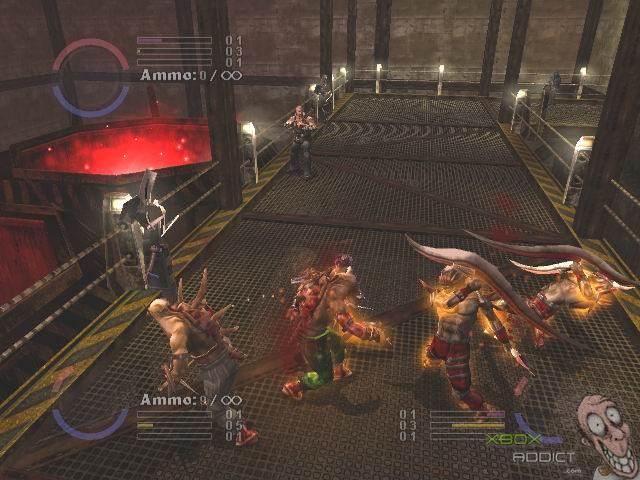
Find the location of a particular element. creature figurine is located at coordinates (173, 326).